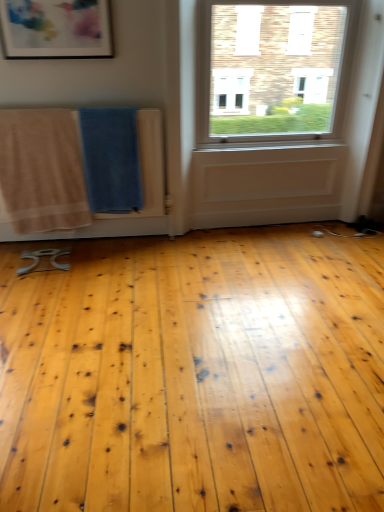
Question: In the image, is matte plastic picture frame at upper left positioned in front of or behind beige cotton towel at left, which is the 2th beach towel in right-to-left order?

Choices:
 (A) behind
 (B) front

Answer: (B)

Question: From the image's perspective, is matte plastic picture frame at upper left located above or below beige cotton towel at left, which is the 1th beach towel in left-to-right order?

Choices:
 (A) above
 (B) below

Answer: (A)

Question: Which of these objects is positioned closest to the blue textured towel at center, the 2th beach towel when ordered from left to right?

Choices:
 (A) beige cotton towel at left, which is the 1th beach towel in left-to-right order
 (B) matte plastic picture frame at upper left

Answer: (A)

Question: Estimate the real-world distances between objects in this image. Which object is farther from the matte plastic picture frame at upper left?

Choices:
 (A) beige cotton towel at left, which is the 2th beach towel in right-to-left order
 (B) blue textured towel at center, positioned as the first beach towel in right-to-left order

Answer: (A)